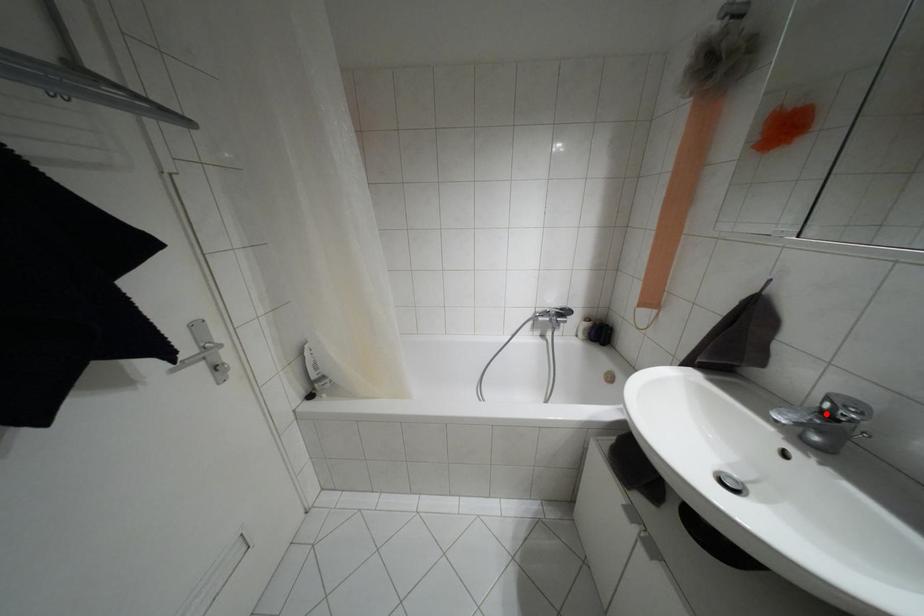
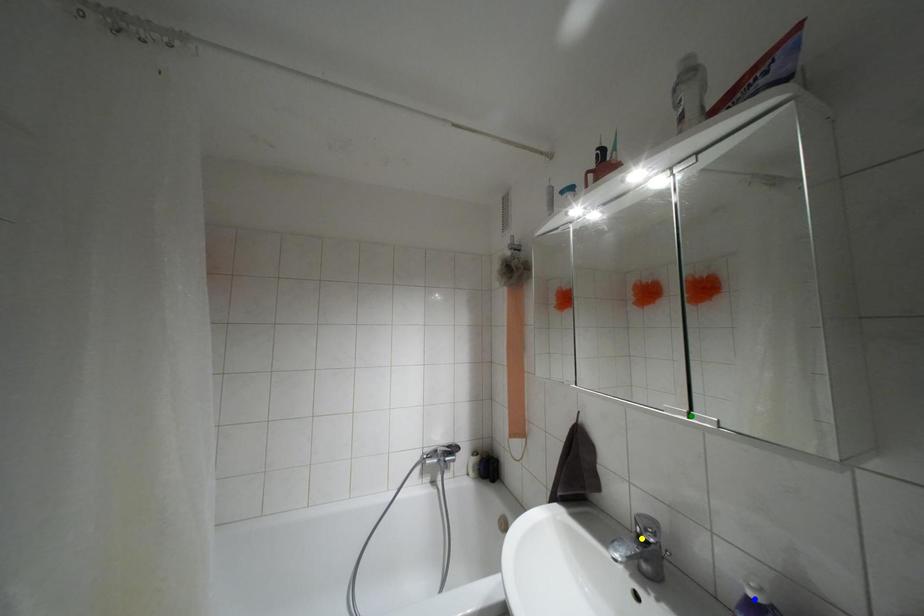
Question: I am providing you with two images of the same scene from different viewpoints. A red point is marked on the first image. You are given multiple points on the second image. Which spot in image 2 lines up with the point in image 1?

Choices:
 (A) yellow point
 (B) blue point
 (C) green point

Answer: (A)